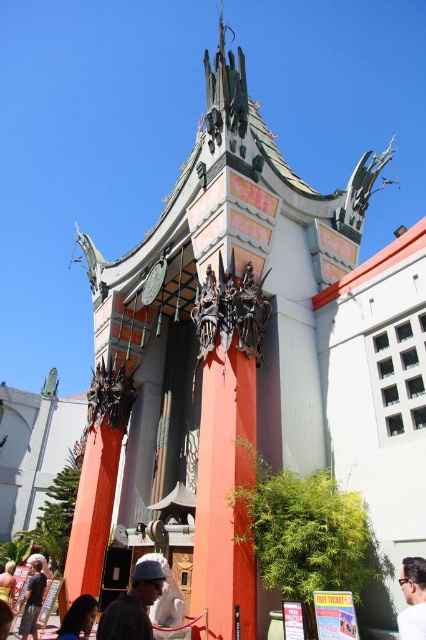
Question: Among these objects, which one is nearest to the camera?

Choices:
 (A) dark gray shirt at lower left
 (B) dark brown hair at lower left
 (C) matte gray helmet at center

Answer: (C)

Question: Which point is farther to the camera?

Choices:
 (A) matte gray helmet at center
 (B) dark brown hair at lower left
 (C) dark gray shirt at lower left
 (D) brown hair at center

Answer: (C)

Question: Does brown hair at center have a smaller size compared to dark gray shirt at lower left?

Choices:
 (A) yes
 (B) no

Answer: (A)

Question: Which point appears closest to the camera in this image?

Choices:
 (A) (77, 625)
 (B) (131, 582)
 (C) (422, 600)
 (D) (28, 580)

Answer: (C)

Question: Is brown hair at center thinner than dark brown hair at lower left?

Choices:
 (A) yes
 (B) no

Answer: (A)

Question: Is brown hair at center thinner than dark brown hair at lower left?

Choices:
 (A) yes
 (B) no

Answer: (A)